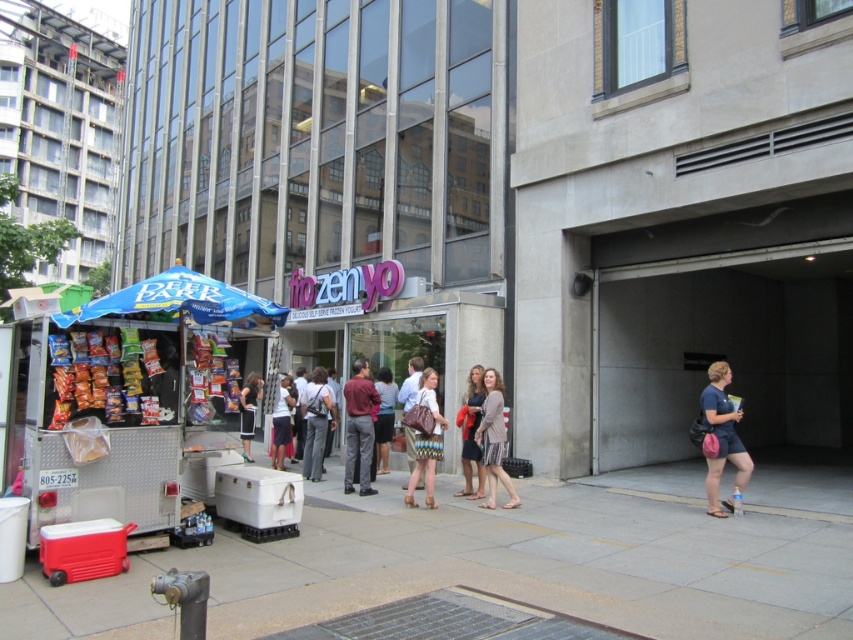
Question: Can you confirm if gray concrete pavement at lower center is bigger than metallic silver food truck at left?

Choices:
 (A) no
 (B) yes

Answer: (B)

Question: Considering the real-world distances, which object is closest to the matte gray skirt at center?

Choices:
 (A) matte brown purse at center
 (B) blue fabric canopy at left
 (C) metallic silver food truck at left
 (D) black fabric shorts at center

Answer: (D)

Question: Is matte blue t-shirt at lower right bigger than matte gray skirt at center?

Choices:
 (A) yes
 (B) no

Answer: (B)

Question: Estimate the real-world distances between objects in this image. Which object is closer to the light brown fabric dress at center?

Choices:
 (A) blue fabric canopy at left
 (B) black fabric shorts at center

Answer: (A)

Question: Which of the following is the farthest from the observer?

Choices:
 (A) (483, 412)
 (B) (718, 472)
 (C) (434, 440)

Answer: (A)

Question: Does matte gray dress at center appear on the left side of matte gray skirt at center?

Choices:
 (A) yes
 (B) no

Answer: (B)